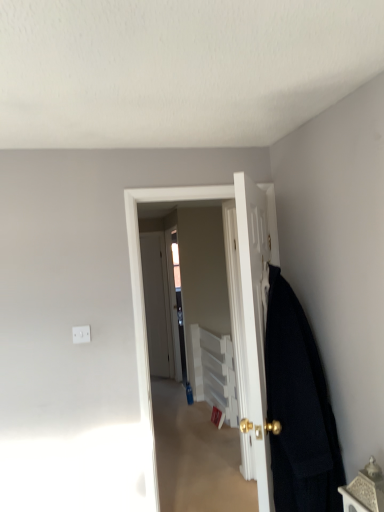
Locate an element on the screen. This screenshot has width=384, height=512. free space in front of clear glass screen door at center is located at coordinates (174, 401).